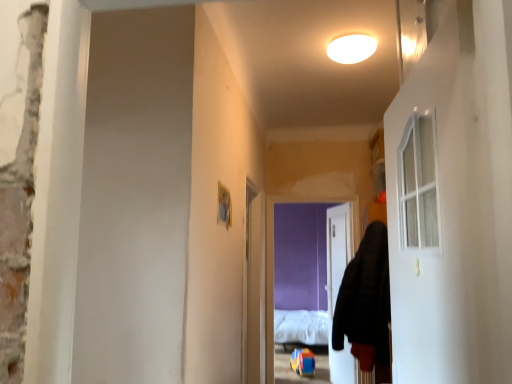
Locate an element on the screen. The width and height of the screenshot is (512, 384). vacant space situated above white matte ceiling light at upper center (from a real-world perspective) is located at coordinates (346, 41).